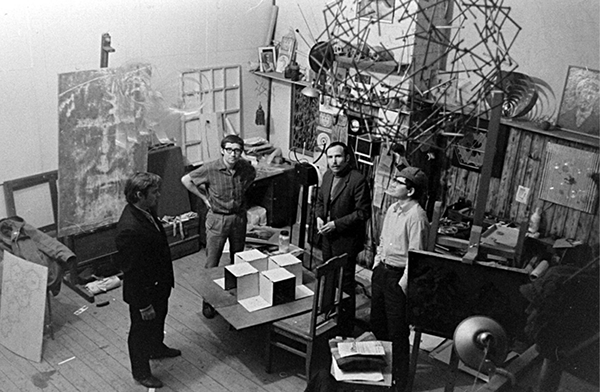
At what (x,y) coordinates should I click in order to perform the action: click on painting. Please return your answer as a coordinate pair (x, y). This screenshot has height=392, width=600. Looking at the image, I should click on (112, 153), (577, 99), (561, 172).